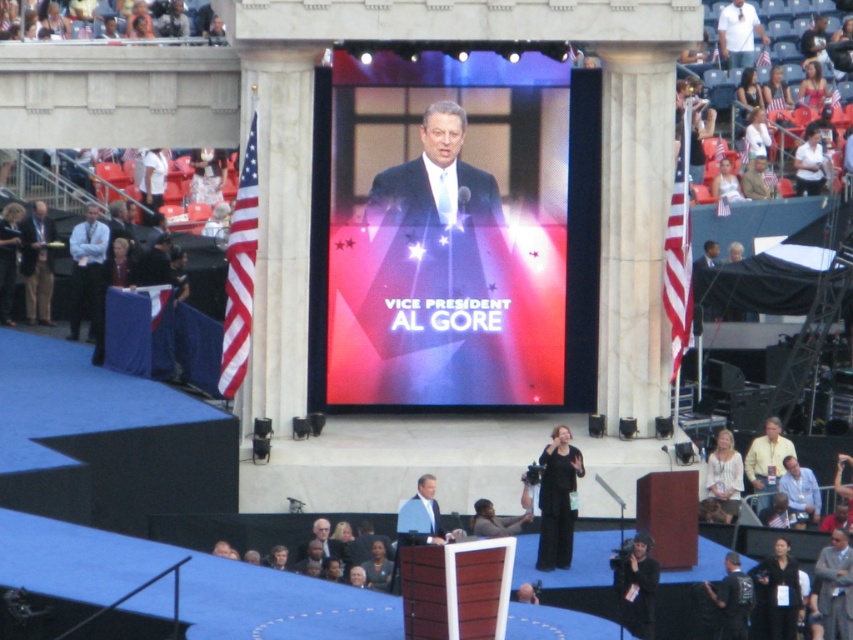
Question: Does black matte dress at center have a smaller size compared to matte blue shirt at left?

Choices:
 (A) yes
 (B) no

Answer: (B)

Question: Where is matte blue shirt at left located in relation to blue fabric at center in the image?

Choices:
 (A) above
 (B) below

Answer: (A)

Question: Which point is farther from the camera taking this photo?

Choices:
 (A) (427, 536)
 (B) (367, 260)
 (C) (572, 552)

Answer: (B)

Question: Can you confirm if shiny blue fabric at center is wider than light brown hair at lower center?

Choices:
 (A) no
 (B) yes

Answer: (A)

Question: Which of the following is the farthest from the observer?

Choices:
 (A) (79, 273)
 (B) (567, 515)
 (C) (335, 540)
 (D) (524, 380)

Answer: (A)

Question: Which of the following is the closest to the observer?

Choices:
 (A) blue fabric at center
 (B) matte blue shirt at left

Answer: (A)